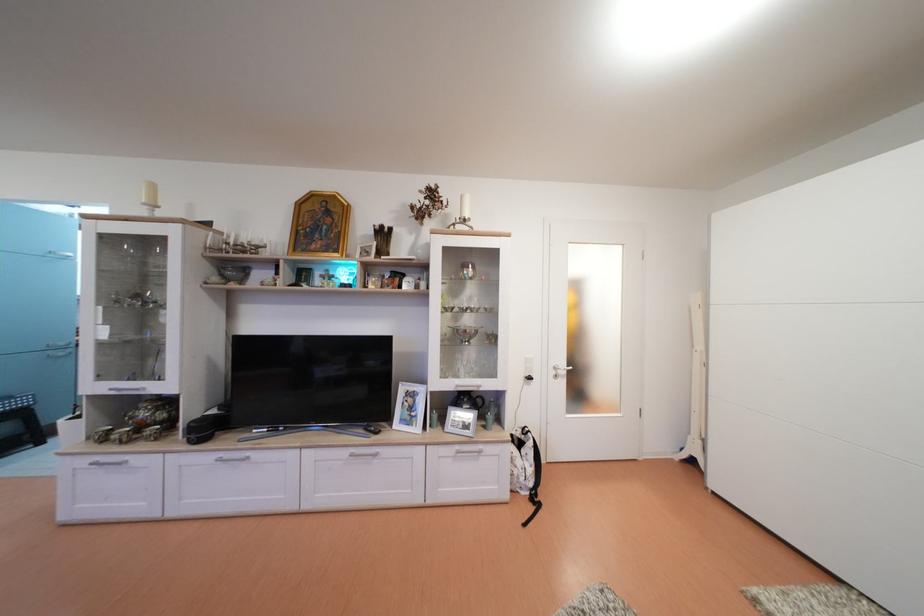
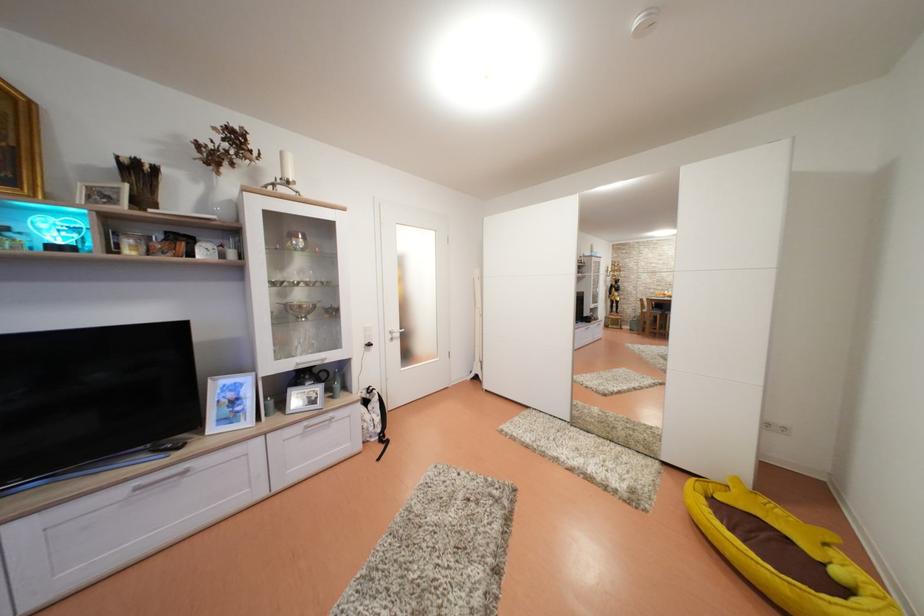
Question: Based on the continuous images, in which direction is the camera rotating? Reply with the corresponding letter.

Choices:
 (A) Left
 (B) Right
 (C) Up
 (D) Down

Answer: (B)